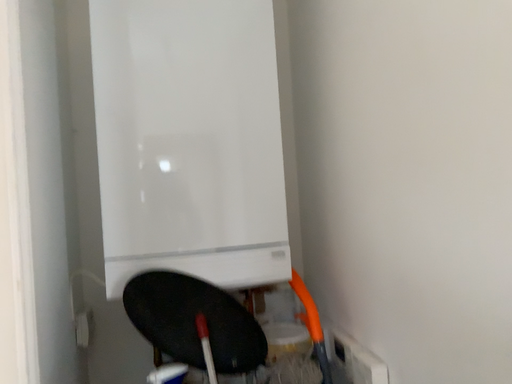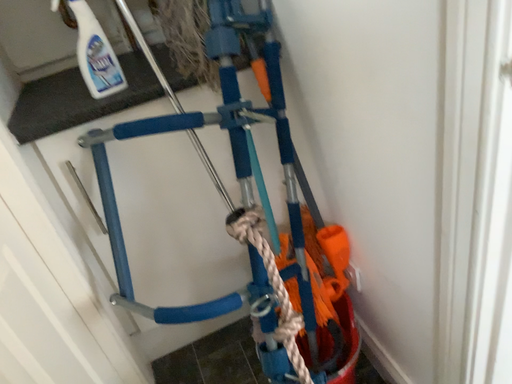
Question: How did the camera likely rotate when shooting the video?

Choices:
 (A) rotated downward
 (B) rotated upward

Answer: (A)